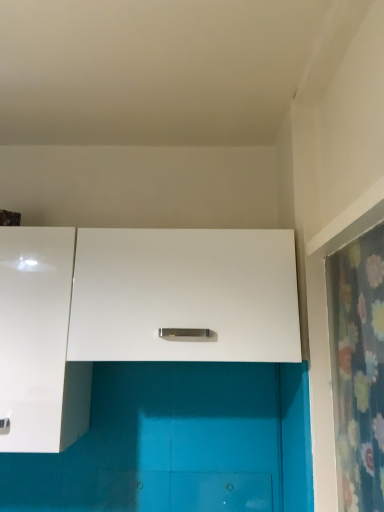
Question: Considering the relative positions of white matte cabinet at center, the 2th cabinetry from the left, and white glossy cabinet at left, the 2th cabinetry viewed from the right, in the image provided, is white matte cabinet at center, the 2th cabinetry from the left, to the left or to the right of white glossy cabinet at left, the 2th cabinetry viewed from the right,?

Choices:
 (A) left
 (B) right

Answer: (B)

Question: Is point (115, 308) closer or farther from the camera than point (54, 388)?

Choices:
 (A) farther
 (B) closer

Answer: (A)

Question: Estimate the real-world distances between objects in this image. Which object is closer to the white glossy cabinet at left, the 2th cabinetry viewed from the right?

Choices:
 (A) white matte cabinet at center, the 2th cabinetry from the left
 (B) floral fabric shower curtain at right

Answer: (A)

Question: Estimate the real-world distances between objects in this image. Which object is closer to the white matte cabinet at center, which appears as the first cabinetry when viewed from the right?

Choices:
 (A) white glossy cabinet at left, placed as the first cabinetry when sorted from left to right
 (B) floral fabric shower curtain at right

Answer: (A)